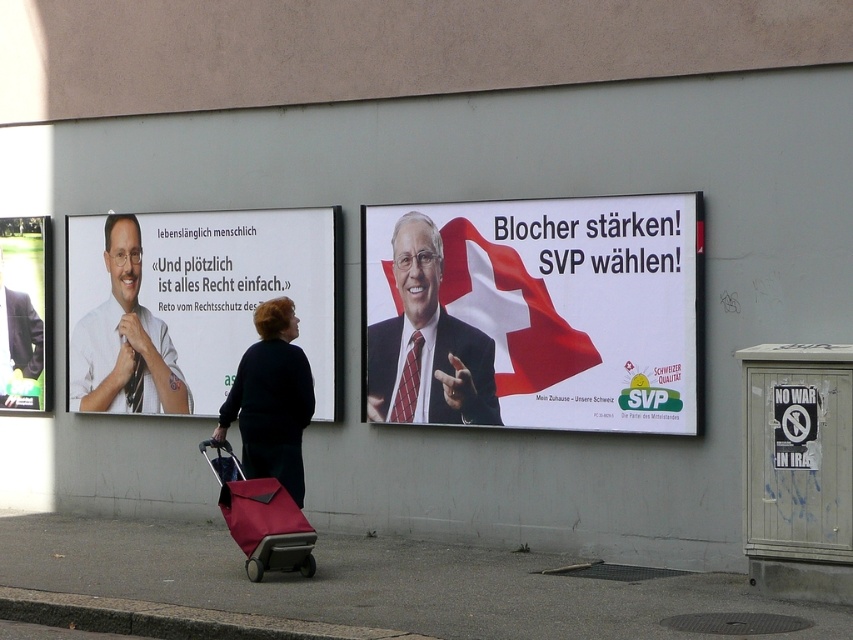
Between smooth asphalt pavement at lower center and red tie at center, which one has more height?

red tie at center is taller.

Does point (166, 592) lie in front of point (447, 314)?

Yes, it is in front of point (447, 314).

Locate an element on the screen. The width and height of the screenshot is (853, 640). smooth asphalt pavement at lower center is located at coordinates (374, 582).

Who is shorter, matte white shirt at left or matte red suitcase at center?

matte red suitcase at center is shorter.

Measure the distance between point (122,276) and camera.

They are 41.57 feet apart.

Who is more distant from viewer, [165,387] or [225,524]?

The point [165,387] is behind.

Identify the location of matte white shirt at left. The image size is (853, 640). (125, 339).

Is smooth asphalt pavement at lower center to the left of matte black jacket at upper left from the viewer's perspective?

Incorrect, smooth asphalt pavement at lower center is not on the left side of matte black jacket at upper left.

Who is more distant from viewer, (590, 604) or (44, 224)?

The point (44, 224) is more distant.

Identify the location of smooth asphalt pavement at lower center. (374, 582).